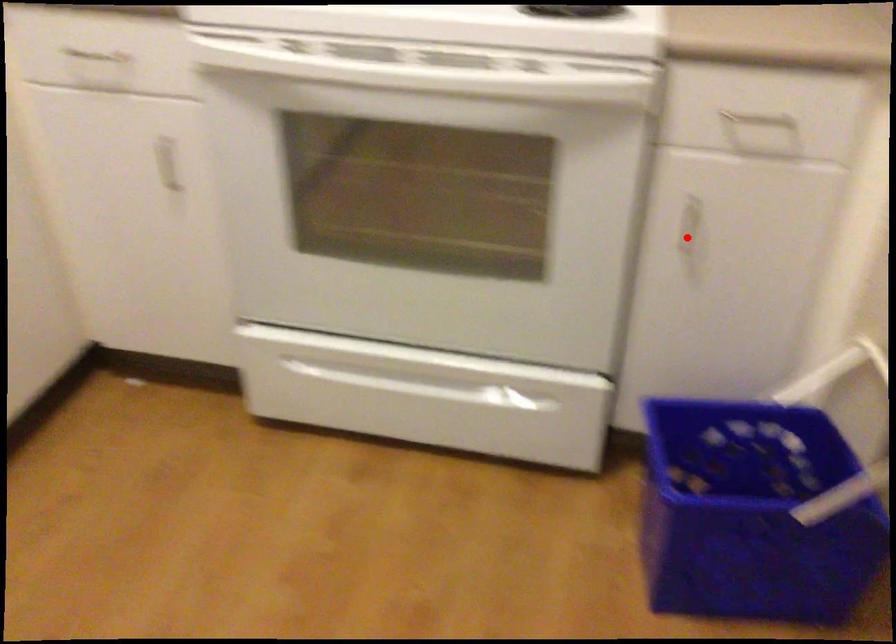
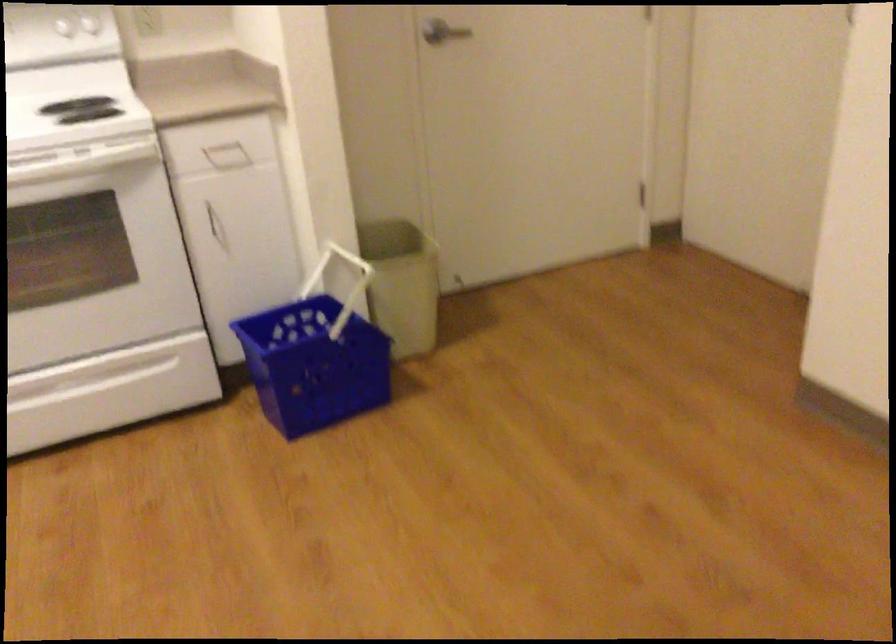
Question: I am providing you with two images of the same scene from different viewpoints. Image1 has a red point marked. In image2, the corresponding 3D location appears at what relative position? Reply with the corresponding letter.

Choices:
 (A) Closer
 (B) Farther

Answer: (B)